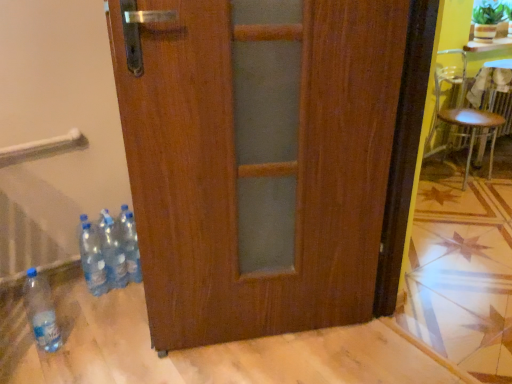
Question: From the image's perspective, is metallic silver chair at right over translucent plastic bottles at lower left, the second bottle when ordered from right to left?

Choices:
 (A) yes
 (B) no

Answer: (A)

Question: Is metallic silver chair at right touching translucent plastic bottles at lower left, the second bottle when ordered from right to left?

Choices:
 (A) yes
 (B) no

Answer: (B)

Question: Can you confirm if metallic silver chair at right is shorter than translucent plastic bottles at lower left, the second bottle when ordered from right to left?

Choices:
 (A) no
 (B) yes

Answer: (A)

Question: From a real-world perspective, is metallic silver chair at right over translucent plastic bottles at lower left, the third bottle in the left-to-right sequence?

Choices:
 (A) no
 (B) yes

Answer: (B)

Question: Considering the relative positions of metallic silver chair at right and translucent plastic bottles at lower left, the third bottle in the left-to-right sequence, in the image provided, is metallic silver chair at right to the right of translucent plastic bottles at lower left, the third bottle in the left-to-right sequence, from the viewer's perspective?

Choices:
 (A) yes
 (B) no

Answer: (A)

Question: From the image's perspective, is green leafy plant at upper right located above or below transparent plastic bottles at lower left, the 2th bottle positioned from the left?

Choices:
 (A) below
 (B) above

Answer: (B)

Question: Considering the positions of green leafy plant at upper right and transparent plastic bottles at lower left, the 2th bottle positioned from the left, in the image, is green leafy plant at upper right taller or shorter than transparent plastic bottles at lower left, the 2th bottle positioned from the left,?

Choices:
 (A) short
 (B) tall

Answer: (A)

Question: From a real-world perspective, is green leafy plant at upper right physically located above or below transparent plastic bottles at lower left, marked as the third bottle in a right-to-left arrangement?

Choices:
 (A) above
 (B) below

Answer: (A)

Question: Is green leafy plant at upper right in front of or behind transparent plastic bottles at lower left, the 2th bottle positioned from the left, in the image?

Choices:
 (A) behind
 (B) front

Answer: (A)

Question: Is metallic silver chair at right spatially inside transparent plastic bottles at lower left, marked as the third bottle in a right-to-left arrangement, or outside of it?

Choices:
 (A) outside
 (B) inside

Answer: (A)

Question: In terms of size, does metallic silver chair at right appear bigger or smaller than transparent plastic bottles at lower left, the 2th bottle positioned from the left?

Choices:
 (A) big
 (B) small

Answer: (A)

Question: Would you say metallic silver chair at right is to the left or to the right of transparent plastic bottles at lower left, marked as the third bottle in a right-to-left arrangement, in the picture?

Choices:
 (A) right
 (B) left

Answer: (A)

Question: From the image's perspective, is metallic silver chair at right located above or below transparent plastic bottles at lower left, marked as the third bottle in a right-to-left arrangement?

Choices:
 (A) below
 (B) above

Answer: (B)

Question: Considering their positions, is metallic silver chair at right located in front of or behind green leafy plant at upper right?

Choices:
 (A) front
 (B) behind

Answer: (A)

Question: Choose the correct answer: Is metallic silver chair at right inside green leafy plant at upper right or outside it?

Choices:
 (A) outside
 (B) inside

Answer: (A)